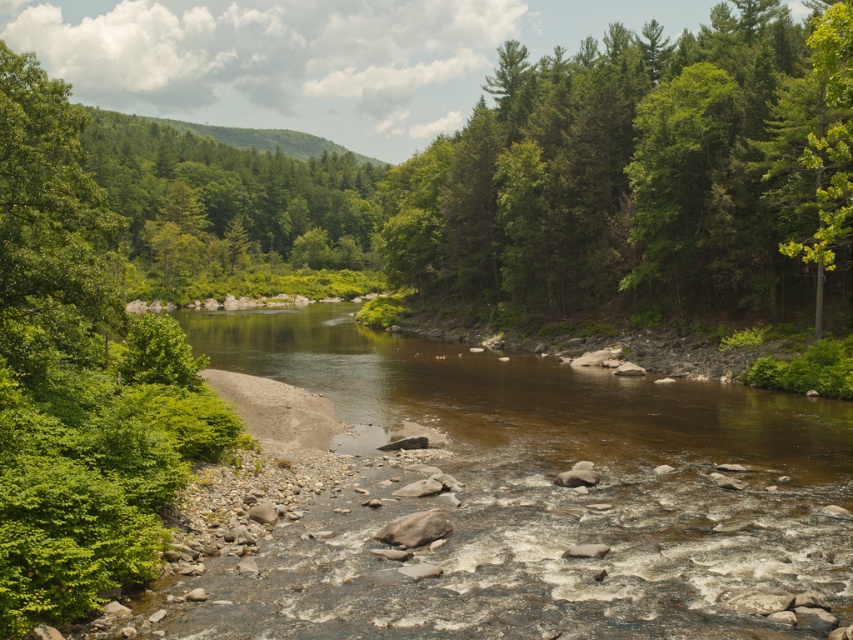
This screenshot has height=640, width=853. Identify the location of brown smooth river at center. (532, 493).

Is brown smooth river at center wider than green leafy tree at upper left?

Indeed, brown smooth river at center has a greater width compared to green leafy tree at upper left.

Between point (259, 371) and point (76, 262), which one is positioned in front?

Point (76, 262) is in front.

The width and height of the screenshot is (853, 640). I want to click on brown smooth river at center, so click(532, 493).

Is green leafy tree at center below green leafy tree at upper left?

Actually, green leafy tree at center is above green leafy tree at upper left.

Which is below, green leafy tree at center or green leafy tree at upper left?

green leafy tree at upper left is lower down.

Is point (363, 236) positioned after point (62, 317)?

Yes.

Find the location of a particular element. green leafy tree at center is located at coordinates (230, 212).

Is point (619, 481) less distant than point (839, 76)?

No, it is behind (839, 76).

At what (x,y) coordinates should I click in order to perform the action: click on brown smooth river at center. Please return your answer as a coordinate pair (x, y). Looking at the image, I should click on (532, 493).